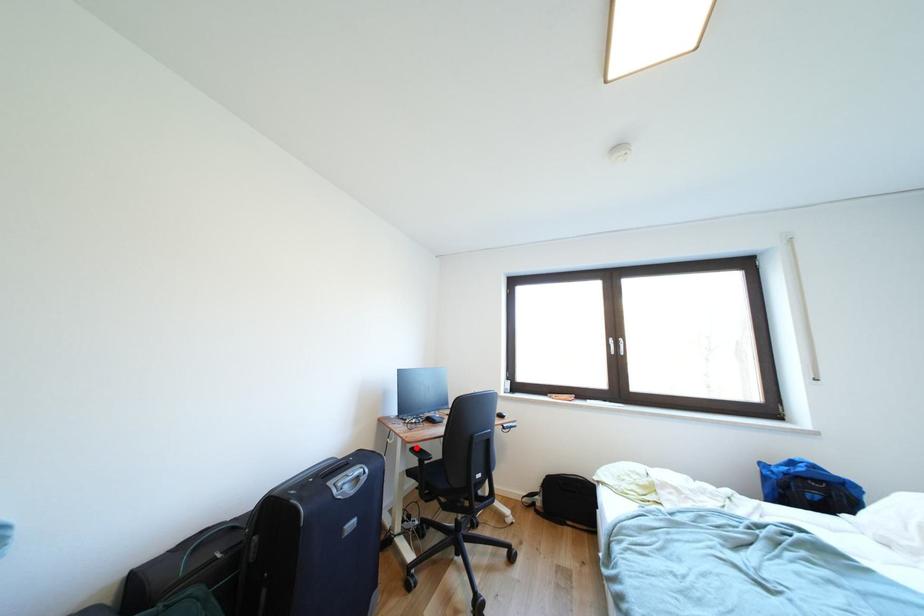
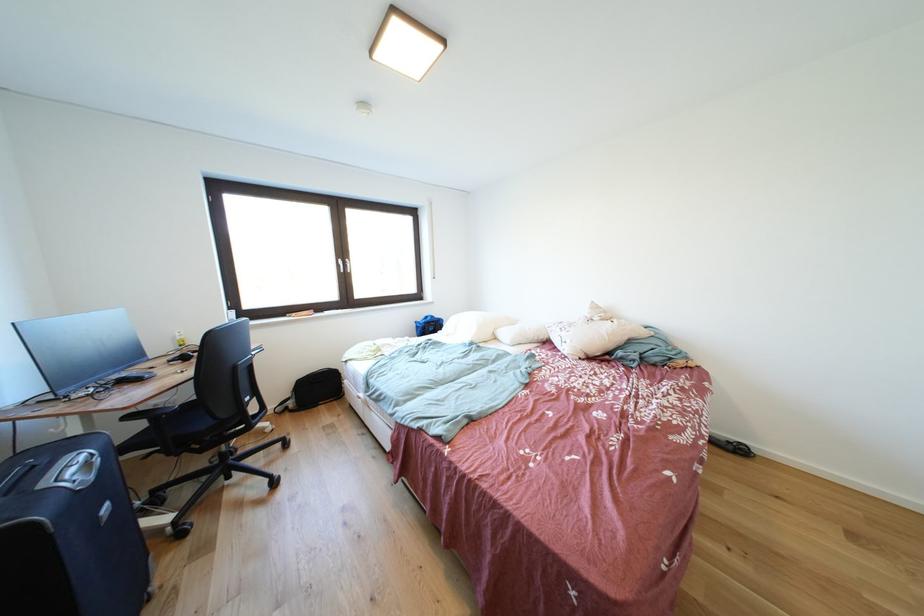
Question: I am providing you with two images of the same scene from different viewpoints. Image1 has a red point marked. In image2, the corresponding 3D location appears at what relative position? Reply with the corresponding letter.

Choices:
 (A) Closer
 (B) Farther

Answer: (A)